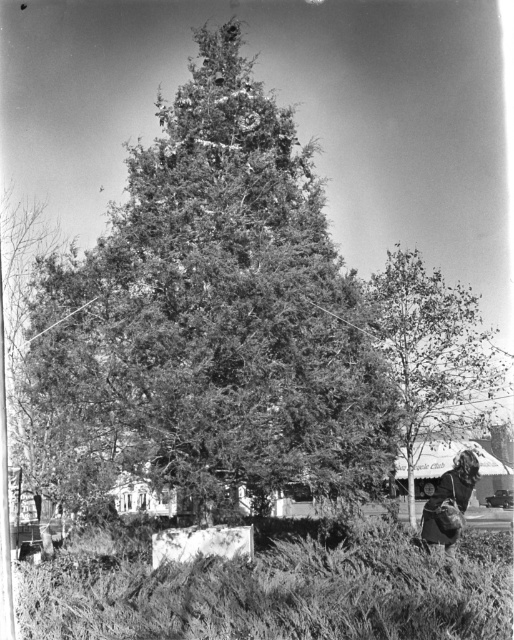
Question: Which of the following is the closest to the observer?

Choices:
 (A) green textured pine tree at center
 (B) dark hair at lower right
 (C) smooth green tree at right

Answer: (A)

Question: Can you confirm if green textured pine tree at center is wider than dark hair at lower right?

Choices:
 (A) yes
 (B) no

Answer: (A)

Question: Which of these objects is positioned farthest from the green textured pine tree at center?

Choices:
 (A) smooth green tree at right
 (B) dark hair at lower right

Answer: (A)

Question: Observing the image, what is the correct spatial positioning of green textured pine tree at center in reference to smooth green tree at right?

Choices:
 (A) right
 (B) left

Answer: (B)

Question: Which object appears farthest from the camera in this image?

Choices:
 (A) dark hair at lower right
 (B) green textured pine tree at center
 (C) smooth green tree at right

Answer: (C)

Question: Observing the image, what is the correct spatial positioning of green textured pine tree at center in reference to smooth green tree at right?

Choices:
 (A) below
 (B) above

Answer: (B)